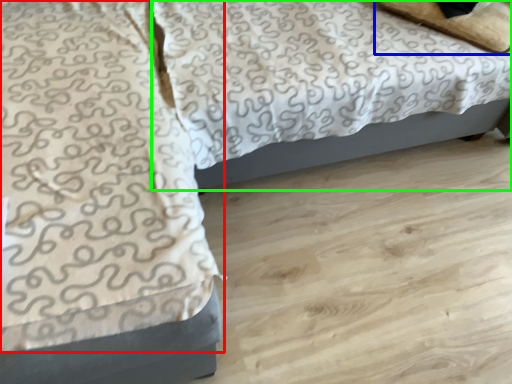
Question: Which object is positioned closest to blanket (highlighted by a red box)? Select from pillow (highlighted by a blue box) and bed (highlighted by a green box).

Choices:
 (A) pillow
 (B) bed

Answer: (B)